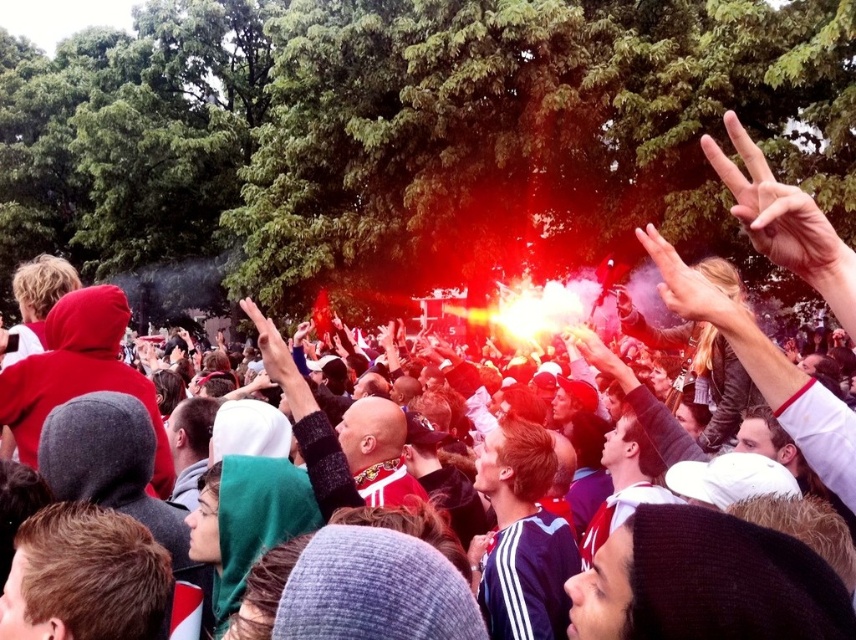
You are a photographer trying to capture a closeup shot of the hands in the crowd. You notice the skinny white hand at upper right and the smooth skin hand at upper right. Which hand should you focus on if you want to capture a wider hand in your frame?

The skinny white hand at upper right might be wider than smooth skin hand at upper right, so you should focus on the skinny white hand at upper right to capture a wider hand in your frame.

You are a photographer at the event and want to capture both the skinny white hand at upper right and the smooth skin hand at upper right in the same frame. Which hand should you focus on to ensure both are visible without cropping?

You should focus on the skinny white hand at upper right because it is larger in size than the smooth skin hand at upper right, making it easier to include both in the frame without cropping.

You are standing in the crowd and see a point at coordinates (782, 218). Which object does this point belong to?

The point at coordinates (782, 218) belongs to the skinny white hand at upper right.